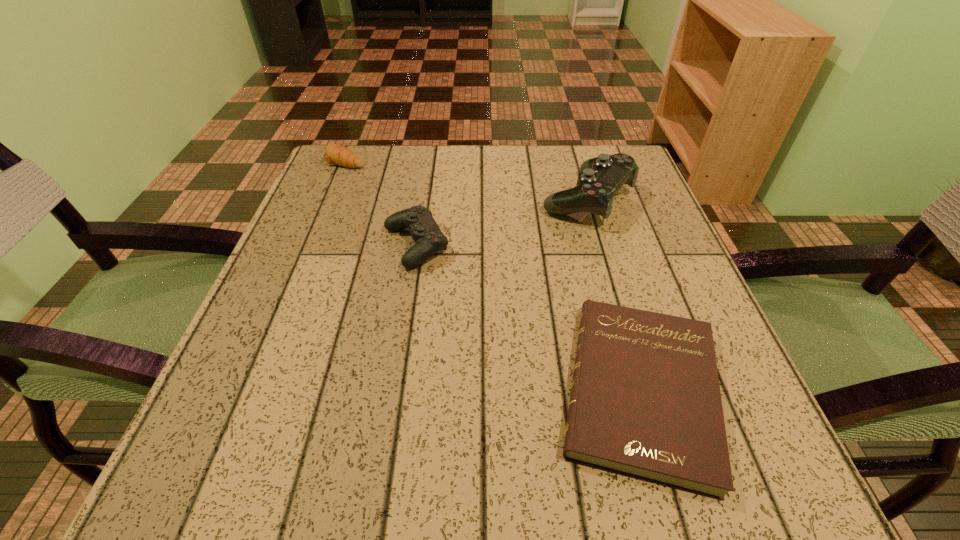
This screenshot has width=960, height=540. In order to click on free region that satisfies the following two spatial constraints: 1. on the front side of the farthest object; 2. on the right side of the hardback book in this screenshot , I will do `click(250, 390)`.

Image resolution: width=960 pixels, height=540 pixels. In order to click on vacant space that satisfies the following two spatial constraints: 1. on the front side of the leftmost object; 2. on the left side of the tallest object in this screenshot , I will do `click(329, 199)`.

The height and width of the screenshot is (540, 960). What are the coordinates of `free location that satisfies the following two spatial constraints: 1. on the back side of the left control; 2. on the left side of the taller control` in the screenshot? It's located at (422, 199).